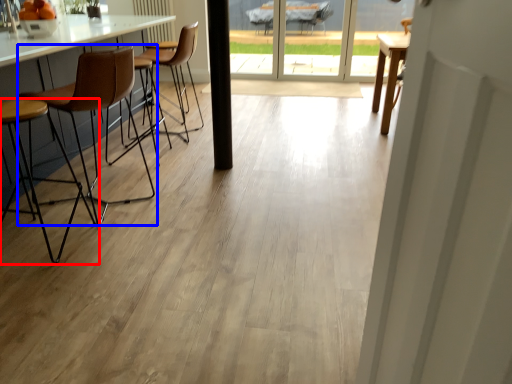
Question: Among these objects, which one is nearest to the camera, chair (highlighted by a red box) or chair (highlighted by a blue box)?

Choices:
 (A) chair
 (B) chair

Answer: (A)